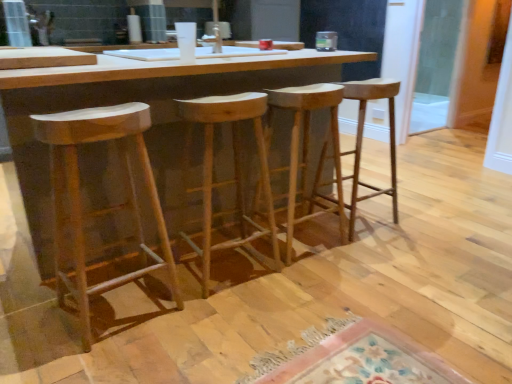
Question: From the image's perspective, is natural wood stool at center, the 3th stool positioned from the left, below natural wood stool at center, acting as the fourth stool starting from the left?

Choices:
 (A) yes
 (B) no

Answer: (A)

Question: Is natural wood stool at center, the 3th stool positioned from the left, facing away from natural wood stool at center, the 1th stool in the right-to-left sequence?

Choices:
 (A) yes
 (B) no

Answer: (B)

Question: Is the depth of natural wood stool at center, the 2th stool when ordered from right to left, greater than that of natural wood stool at center, the 1th stool in the right-to-left sequence?

Choices:
 (A) yes
 (B) no

Answer: (B)

Question: Is natural wood stool at center, the 3th stool positioned from the left, bigger than natural wood stool at center, the 1th stool in the right-to-left sequence?

Choices:
 (A) yes
 (B) no

Answer: (B)

Question: From the image's perspective, is natural wood stool at center, the 3th stool positioned from the left, on top of natural wood stool at center, the 1th stool in the right-to-left sequence?

Choices:
 (A) no
 (B) yes

Answer: (A)

Question: From a real-world perspective, is natural wood stool at center, the 2th stool when ordered from right to left, located higher than natural wood stool at center, acting as the fourth stool starting from the left?

Choices:
 (A) yes
 (B) no

Answer: (A)

Question: Is natural wood table at center oriented away from natural wood stool at center, which appears as the 3th stool when viewed from the right?

Choices:
 (A) no
 (B) yes

Answer: (B)

Question: Considering the relative sizes of natural wood table at center and natural wood stool at center, the second stool viewed from the left, in the image provided, is natural wood table at center bigger than natural wood stool at center, the second stool viewed from the left,?

Choices:
 (A) yes
 (B) no

Answer: (A)

Question: Is natural wood table at center positioned far away from natural wood stool at center, the second stool viewed from the left?

Choices:
 (A) yes
 (B) no

Answer: (B)

Question: Considering the relative sizes of natural wood table at center and natural wood stool at center, which appears as the 3th stool when viewed from the right, in the image provided, is natural wood table at center taller than natural wood stool at center, which appears as the 3th stool when viewed from the right,?

Choices:
 (A) no
 (B) yes

Answer: (B)

Question: Could you tell me if natural wood table at center is turned towards natural wood stool at center, the second stool viewed from the left?

Choices:
 (A) yes
 (B) no

Answer: (A)

Question: From a real-world perspective, is natural wood table at center physically above natural wood stool at center, which appears as the 3th stool when viewed from the right?

Choices:
 (A) yes
 (B) no

Answer: (A)

Question: Does natural wood stool at left, the 1th stool from the left, come in front of natural wood table at center?

Choices:
 (A) yes
 (B) no

Answer: (A)